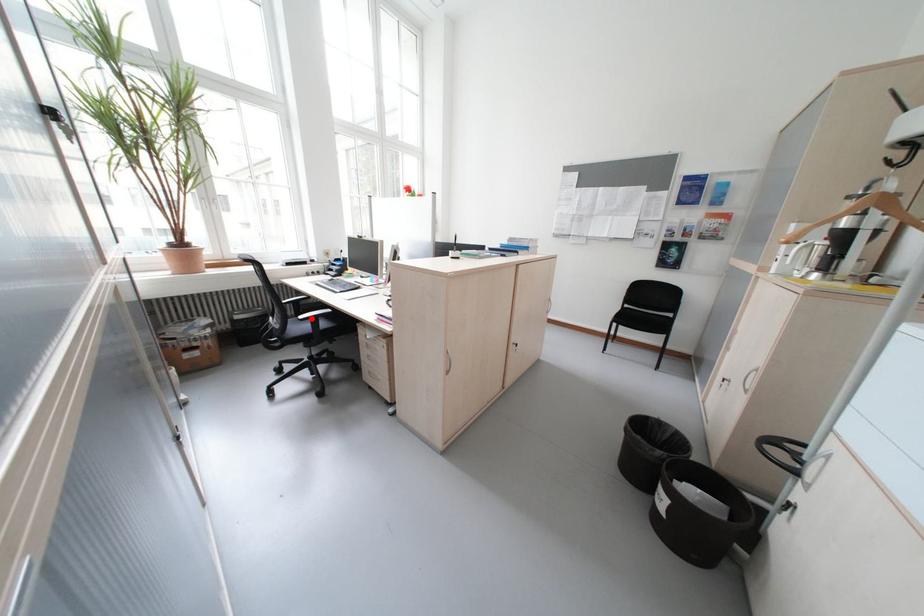
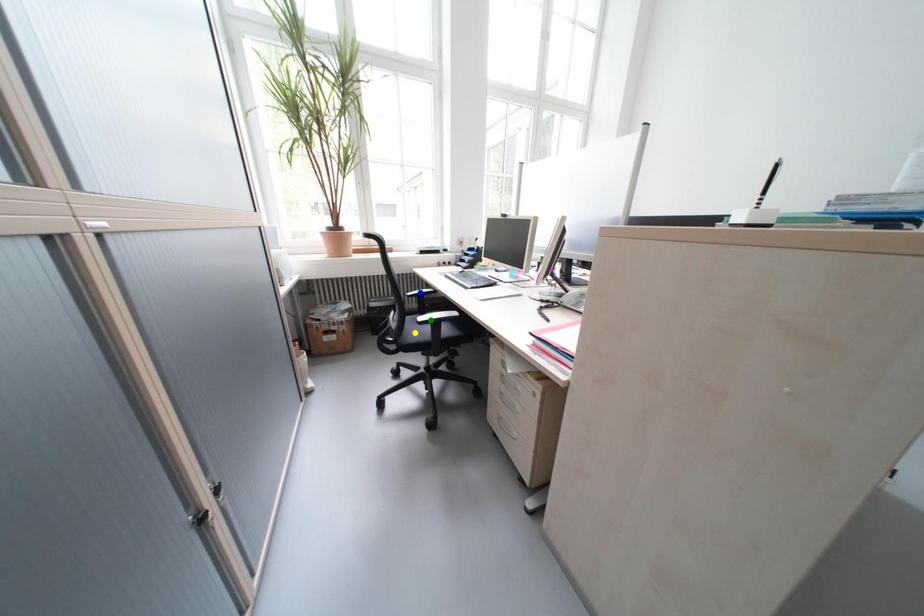
Question: I am providing you with two images of the same scene from different viewpoints. A red point is marked on the first image. You are given multiple points on the second image. Which point in image 2 represents the same 3d spot as the red point in image 1?

Choices:
 (A) green point
 (B) yellow point
 (C) blue point

Answer: (A)